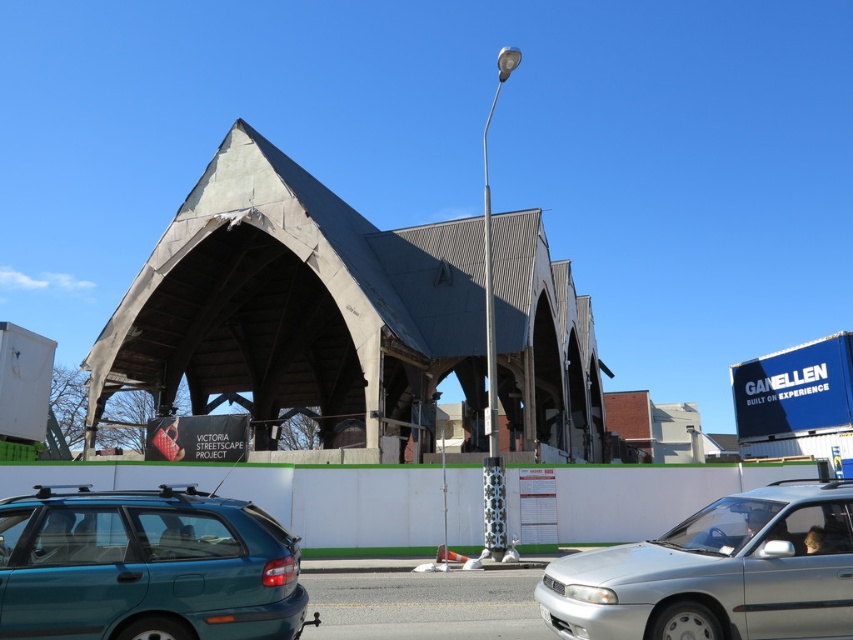
You are a delivery driver who needs to park your teal matte hatchback at lower left and silver metallic sedan at center in a parking lot with spaces that are exactly the same size as the hatchback. Can both vehicles fit into separate parking spaces without overlapping?

The teal matte hatchback at lower left is smaller than the silver metallic sedan at center. Since the parking spaces are the same size as the hatchback, the sedan will not fit into the spaces. Only the teal matte hatchback at lower left can fit into one parking space.

You are a delivery driver who needs to park your vehicle in the parking lot behind the teal matte hatchback at lower left. The parking spot is at coordinates point 0.887, 0.171. Can you park your vehicle there?

The teal matte hatchback at lower left is already located at point (x=144, y=566), so the parking spot is occupied. Choose another spot.